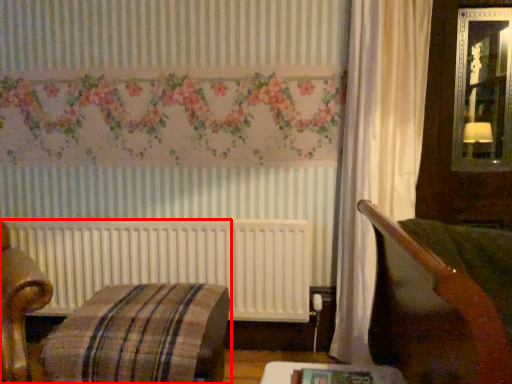
Question: From the image's perspective, where is furniture (annotated by the red box) located relative to table?

Choices:
 (A) below
 (B) above

Answer: (A)